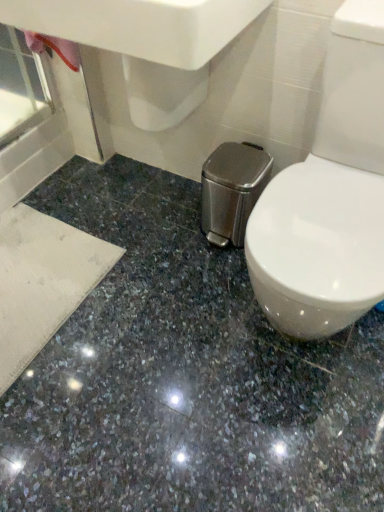
Question: Is shiny granite floor at center aimed at white glossy sink at upper center?

Choices:
 (A) yes
 (B) no

Answer: (B)

Question: Can we say shiny granite floor at center lies outside white glossy sink at upper center?

Choices:
 (A) yes
 (B) no

Answer: (A)

Question: Considering the relative sizes of shiny granite floor at center and white glossy sink at upper center in the image provided, is shiny granite floor at center taller than white glossy sink at upper center?

Choices:
 (A) yes
 (B) no

Answer: (B)

Question: Are shiny granite floor at center and white glossy sink at upper center far apart?

Choices:
 (A) no
 (B) yes

Answer: (A)

Question: From a real-world perspective, is shiny granite floor at center physically below white glossy sink at upper center?

Choices:
 (A) yes
 (B) no

Answer: (A)

Question: Does shiny granite floor at center have a lesser height compared to white glossy sink at upper center?

Choices:
 (A) yes
 (B) no

Answer: (A)

Question: Does white glossy sink at upper center have a lesser height compared to shiny granite floor at center?

Choices:
 (A) yes
 (B) no

Answer: (B)

Question: Could you tell me if white glossy sink at upper center is facing shiny granite floor at center?

Choices:
 (A) yes
 (B) no

Answer: (B)

Question: Is white glossy sink at upper center in contact with shiny granite floor at center?

Choices:
 (A) no
 (B) yes

Answer: (A)

Question: Can we say white glossy sink at upper center lies outside shiny granite floor at center?

Choices:
 (A) no
 (B) yes

Answer: (B)

Question: Is white glossy sink at upper center to the right of shiny granite floor at center from the viewer's perspective?

Choices:
 (A) no
 (B) yes

Answer: (A)

Question: Is white glossy sink at upper center not near shiny granite floor at center?

Choices:
 (A) yes
 (B) no

Answer: (B)

Question: In terms of size, does white glossy sink at upper center appear bigger or smaller than shiny granite floor at center?

Choices:
 (A) small
 (B) big

Answer: (B)